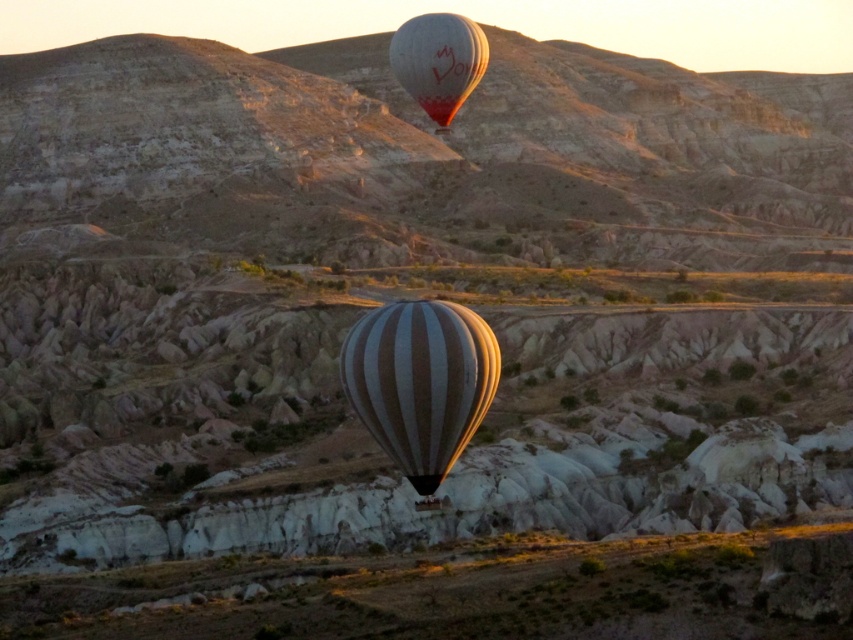
Which of these two, striped fabric balloon at center or white striped balloon at upper center, stands taller?

striped fabric balloon at center

This screenshot has width=853, height=640. In order to click on striped fabric balloon at center in this screenshot , I will do `click(421, 381)`.

Image resolution: width=853 pixels, height=640 pixels. I want to click on striped fabric balloon at center, so click(x=421, y=381).